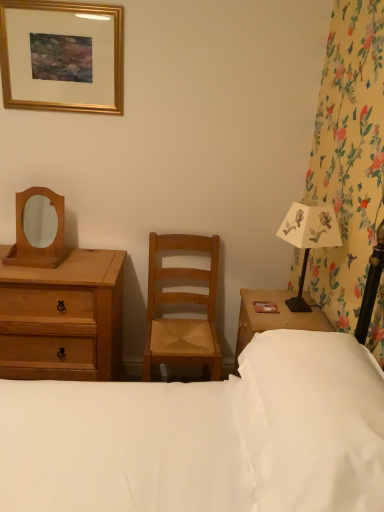
Question: From the image's perspective, is light brown wooden chest of drawers at left above or below white paper lampshade at right?

Choices:
 (A) above
 (B) below

Answer: (B)

Question: In the image, is light brown wooden chest of drawers at left positioned in front of or behind white paper lampshade at right?

Choices:
 (A) front
 (B) behind

Answer: (B)

Question: Considering the real-world distances, which object is closest to the gold wooden picture frame at upper left?

Choices:
 (A) white fabric bed at center
 (B) natural wood chair at center
 (C) white soft pillow at lower right
 (D) light brown wooden chest of drawers at left
 (E) wooden mirror at left

Answer: (E)

Question: Considering the real-world distances, which object is farthest from the wooden mirror at left?

Choices:
 (A) white soft pillow at lower right
 (B) natural wood chair at center
 (C) white fabric bed at center
 (D) light brown wooden chest of drawers at left
 (E) white paper lampshade at right

Answer: (A)